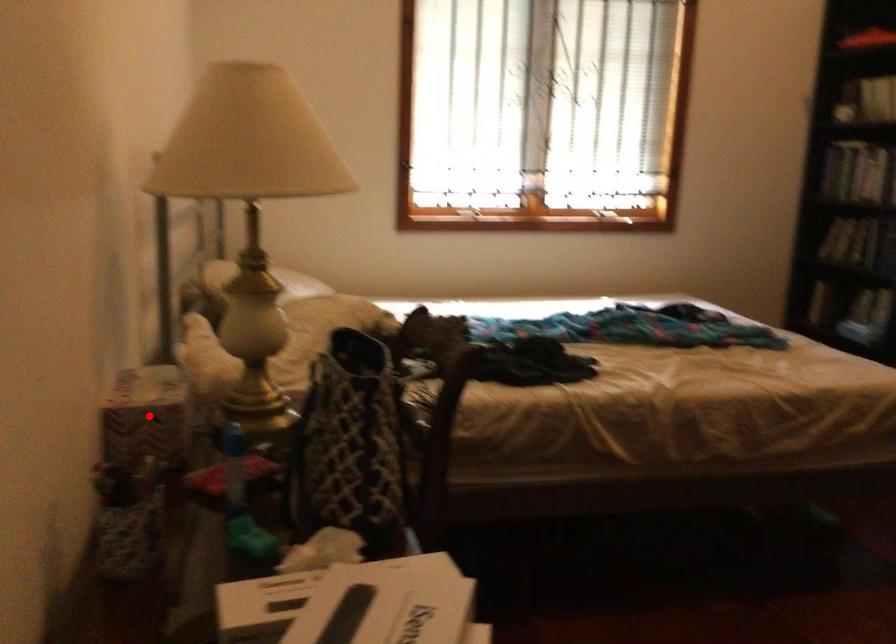
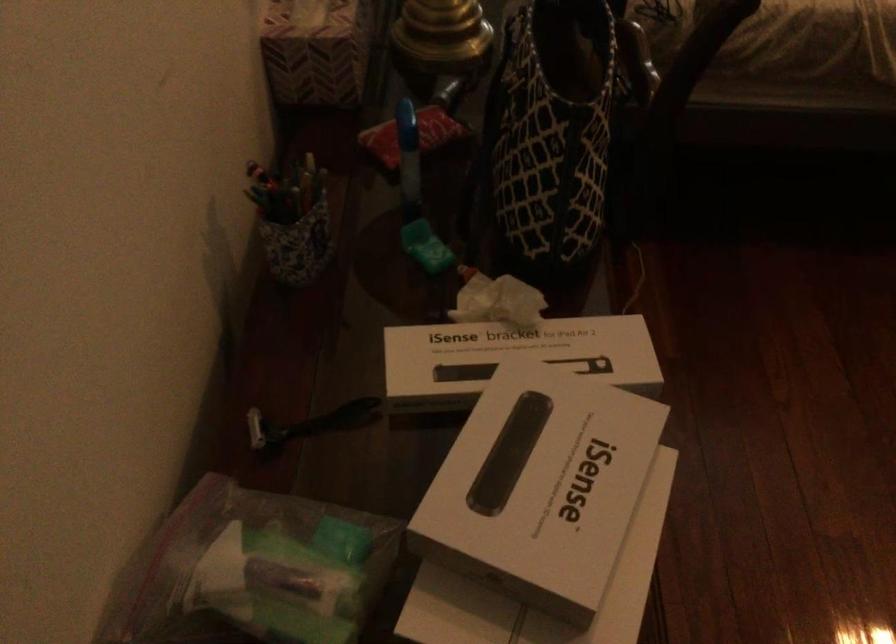
Find the pixel in the second image that matches the highlighted location in the first image.

(315, 51)